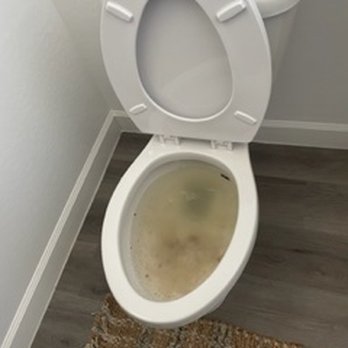
Where is `toilet bowl`? The image size is (348, 348). toilet bowl is located at coordinates (142, 195).